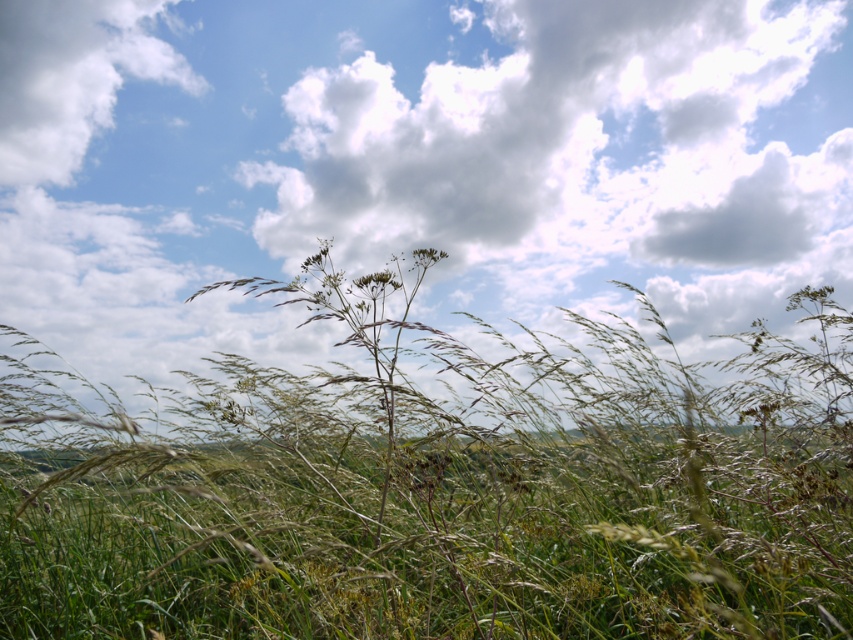
Question: Can you confirm if green grass at center is wider than white fluffy cloud at upper left?

Choices:
 (A) no
 (B) yes

Answer: (B)

Question: Among these objects, which one is nearest to the camera?

Choices:
 (A) white fluffy cloud at upper left
 (B) green grass at center

Answer: (B)

Question: Is green grass at center wider than white fluffy cloud at upper left?

Choices:
 (A) no
 (B) yes

Answer: (B)

Question: Which point appears closest to the camera in this image?

Choices:
 (A) (15, 628)
 (B) (84, 109)

Answer: (A)

Question: Is green grass at center positioned in front of white fluffy cloud at upper left?

Choices:
 (A) yes
 (B) no

Answer: (A)

Question: Which of the following is the farthest from the observer?

Choices:
 (A) (195, 522)
 (B) (68, 20)

Answer: (B)